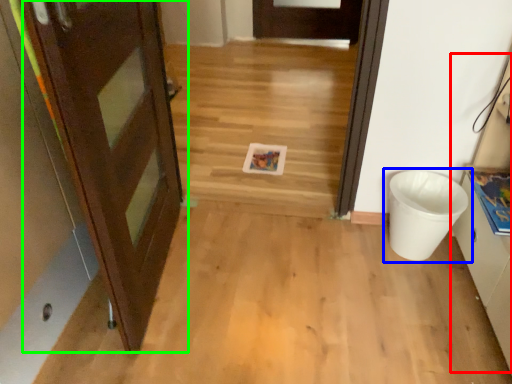
Question: Which object is positioned closest to cabinetry (highlighted by a red box)? Select from waste container (highlighted by a blue box) and door (highlighted by a green box).

Choices:
 (A) waste container
 (B) door

Answer: (A)